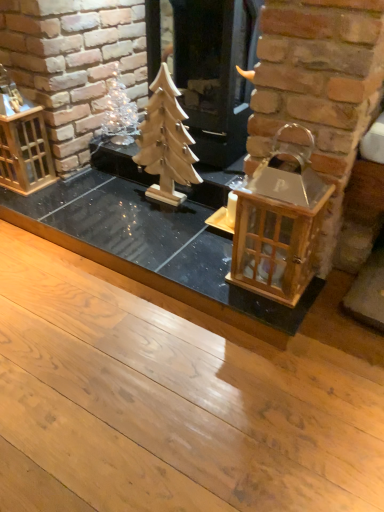
Identify the location of vacant space in front of wooden lantern at left. (28, 205).